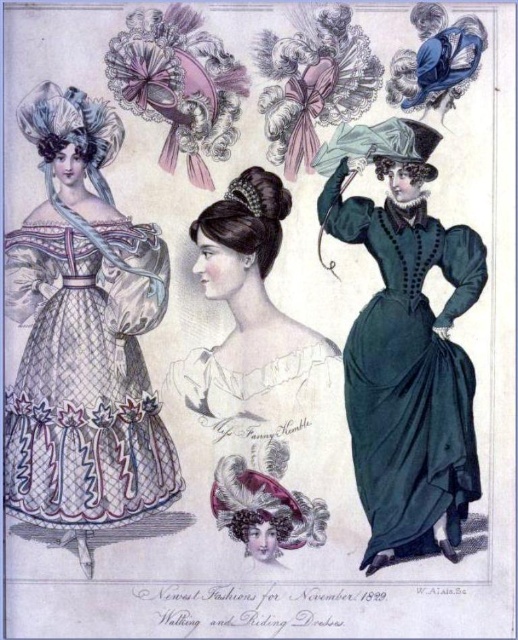
Question: Considering the relative positions of white netted dress at left and white lace dress at center in the image provided, where is white netted dress at left located with respect to white lace dress at center?

Choices:
 (A) left
 (B) right

Answer: (A)

Question: Where is white netted dress at left located in relation to white lace dress at center in the image?

Choices:
 (A) above
 (B) below

Answer: (B)

Question: Estimate the real-world distances between objects in this image. Which object is farther from the velvet green dress at center?

Choices:
 (A) white lace dress at center
 (B) white netted dress at left

Answer: (B)

Question: Is velvet green dress at center in front of white lace dress at center?

Choices:
 (A) no
 (B) yes

Answer: (B)

Question: Which object is farther from the camera taking this photo?

Choices:
 (A) white lace dress at center
 (B) velvet green dress at center

Answer: (A)

Question: Which point is closer to the camera?

Choices:
 (A) (99, 250)
 (B) (408, 499)
 (C) (248, 269)

Answer: (B)